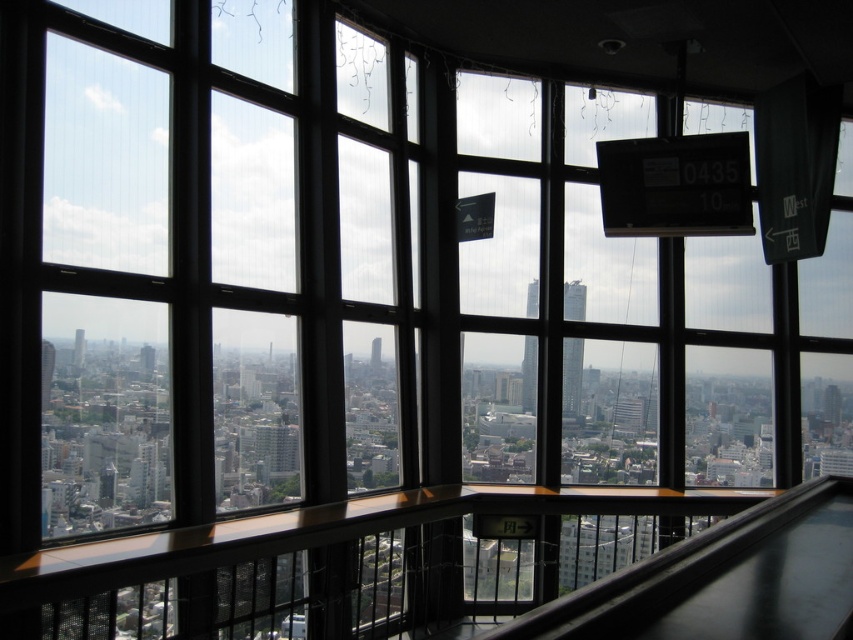
Question: Which point appears farthest from the camera in this image?

Choices:
 (A) (50, 349)
 (B) (567, 392)
 (C) (80, 346)
 (D) (537, 314)

Answer: (D)

Question: In this image, where is smooth glass tower at center located relative to matte glass tower at center?

Choices:
 (A) below
 (B) above

Answer: (A)

Question: Which object appears closest to the camera in this image?

Choices:
 (A) matte glass tower at center
 (B) smooth glass tower at center

Answer: (A)

Question: Can you confirm if matte glass tower at left is positioned above matte glass tower at center?

Choices:
 (A) yes
 (B) no

Answer: (B)

Question: Among these points, which one is farthest from the camera?

Choices:
 (A) (527, 408)
 (B) (570, 308)
 (C) (44, 392)

Answer: (B)

Question: Does matte glass tower at left have a larger size compared to matte glass tower at center?

Choices:
 (A) no
 (B) yes

Answer: (B)